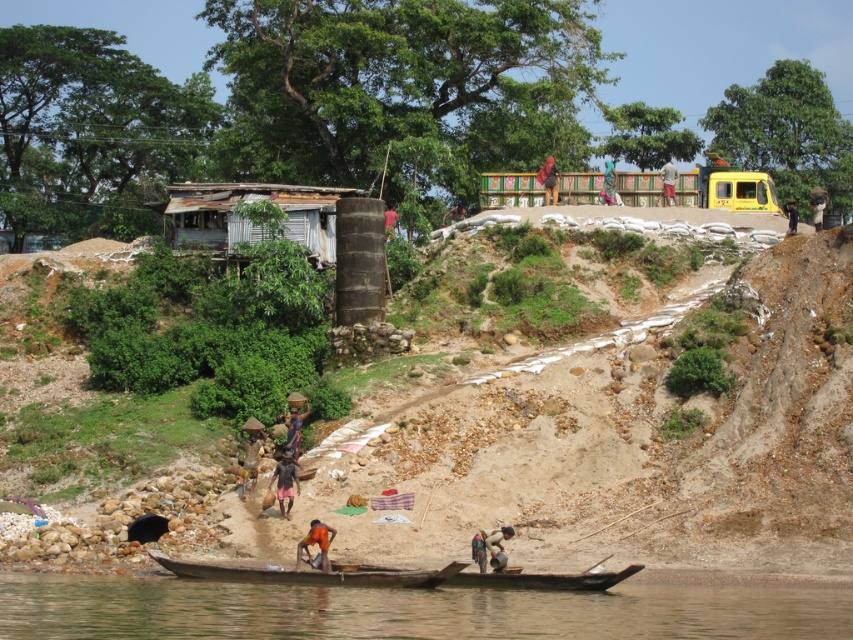
Question: Which object is farther from the camera taking this photo?

Choices:
 (A) brown fabric bag at lower center
 (B) brown woven basket at lower center
 (C) wooden boat at lower center

Answer: (B)

Question: Observing the image, what is the correct spatial positioning of multicolored fabric at upper center in reference to dark brown wooden pole at center?

Choices:
 (A) above
 (B) below

Answer: (A)

Question: From the image, what is the correct spatial relationship of multicolored fabric at upper center in relation to dark brown wooden pole at center?

Choices:
 (A) right
 (B) left

Answer: (A)

Question: Which point is closer to the camera taking this photo?

Choices:
 (A) pos(550,157)
 (B) pos(451,211)

Answer: (B)

Question: Which point is closer to the camera?

Choices:
 (A) (474, 554)
 (B) (236, 202)
 (C) (793, 218)

Answer: (A)

Question: Can you confirm if wooden boat at lower center is wider than dark brown wooden boat at center?

Choices:
 (A) yes
 (B) no

Answer: (A)